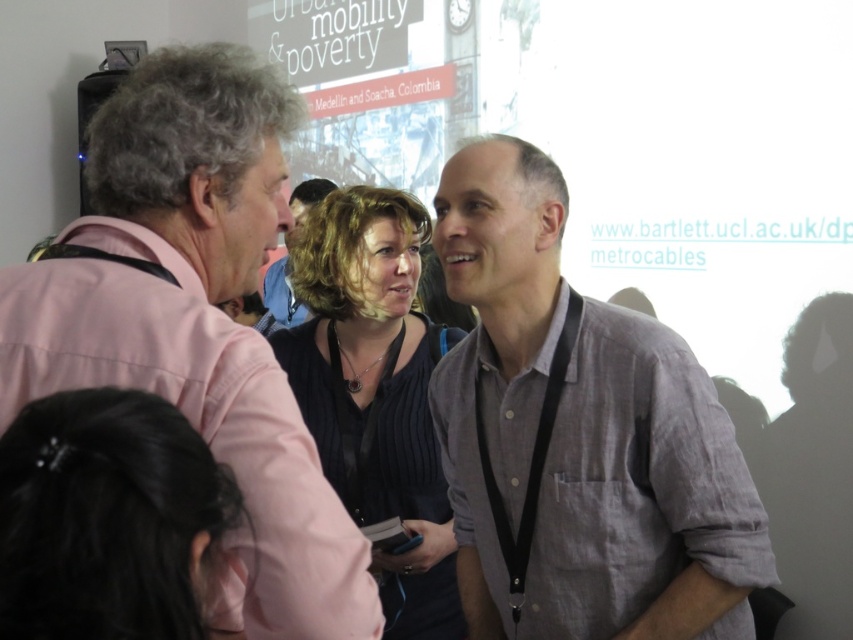
You are a photographer at a conference and need to adjust your camera to focus on the gray linen shirt at center and the black hair at lower left. Which object should you focus on first if you want to capture both in a single shot without refocusing?

The gray linen shirt at center is positioned over black hair at lower left, so you should focus on the gray linen shirt at center first since it is closer to the camera.

You are organizing a photo shoot and need to ensure that all subjects are visible in the frame. Given that the gray linen shirt at center and the black hair at lower left are both in the shot, which one appears larger in the image?

The gray linen shirt at center appears larger than the black hair at lower left in the image.